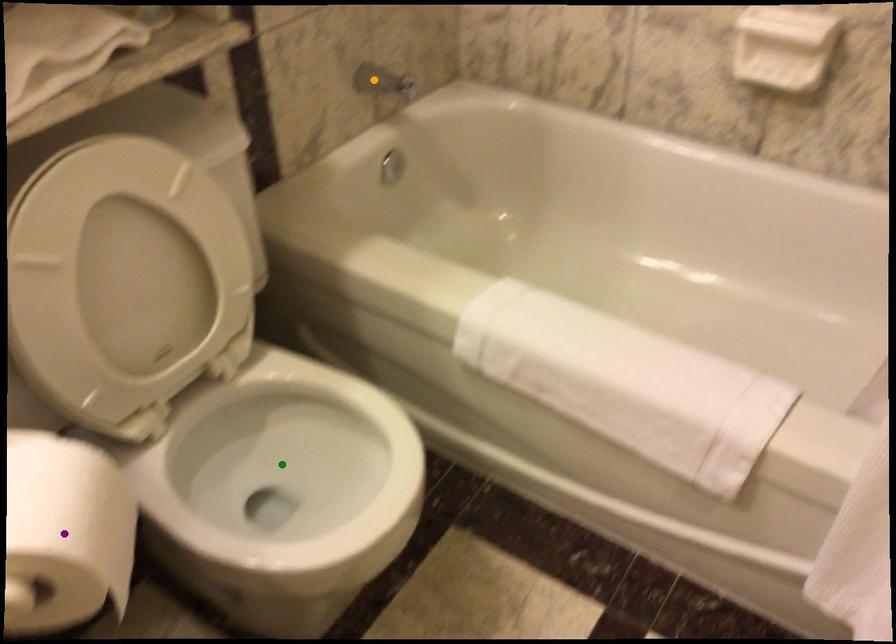
Order these from farthest to nearest:
- green point
- orange point
- purple point

orange point → green point → purple point